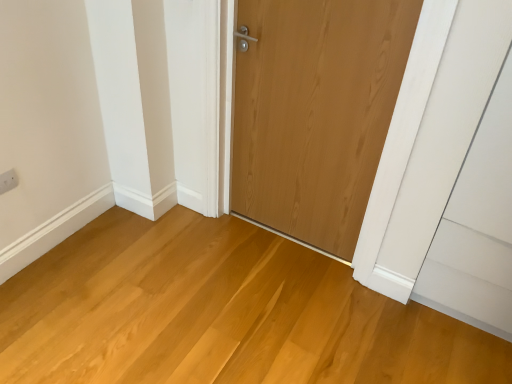
Question: Considering the relative sizes of white plastic electric outlet at upper left and natural wood floor at center in the image provided, is white plastic electric outlet at upper left bigger than natural wood floor at center?

Choices:
 (A) yes
 (B) no

Answer: (B)

Question: Does white plastic electric outlet at upper left appear on the right side of natural wood floor at center?

Choices:
 (A) yes
 (B) no

Answer: (B)

Question: Could you tell me if white plastic electric outlet at upper left is turned towards natural wood floor at center?

Choices:
 (A) no
 (B) yes

Answer: (B)

Question: Is white plastic electric outlet at upper left shorter than natural wood floor at center?

Choices:
 (A) no
 (B) yes

Answer: (A)

Question: Can you confirm if white plastic electric outlet at upper left is wider than natural wood floor at center?

Choices:
 (A) yes
 (B) no

Answer: (B)

Question: From a real-world perspective, is white plastic electric outlet at upper left on natural wood floor at center?

Choices:
 (A) no
 (B) yes

Answer: (B)

Question: From the image's perspective, would you say natural wood door at center is positioned over natural wood floor at center?

Choices:
 (A) no
 (B) yes

Answer: (B)

Question: Does natural wood door at center turn towards natural wood floor at center?

Choices:
 (A) no
 (B) yes

Answer: (B)

Question: Are natural wood door at center and natural wood floor at center far apart?

Choices:
 (A) no
 (B) yes

Answer: (A)

Question: From a real-world perspective, is natural wood door at center over natural wood floor at center?

Choices:
 (A) no
 (B) yes

Answer: (B)

Question: Does natural wood door at center have a smaller size compared to natural wood floor at center?

Choices:
 (A) yes
 (B) no

Answer: (A)

Question: Does natural wood door at center have a greater height compared to natural wood floor at center?

Choices:
 (A) yes
 (B) no

Answer: (A)

Question: Can you confirm if natural wood floor at center is positioned to the right of white plastic electric outlet at upper left?

Choices:
 (A) yes
 (B) no

Answer: (A)